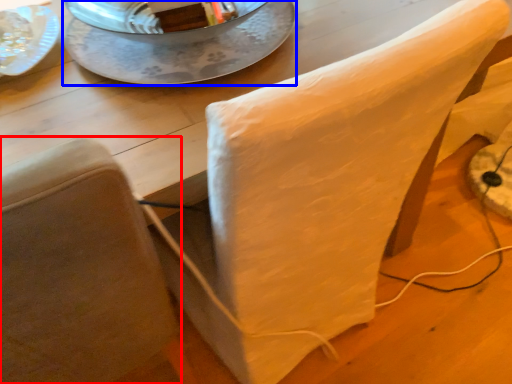
Question: Which object is closer to the camera taking this photo, chair (highlighted by a red box) or glass plate (highlighted by a blue box)?

Choices:
 (A) chair
 (B) glass plate

Answer: (A)